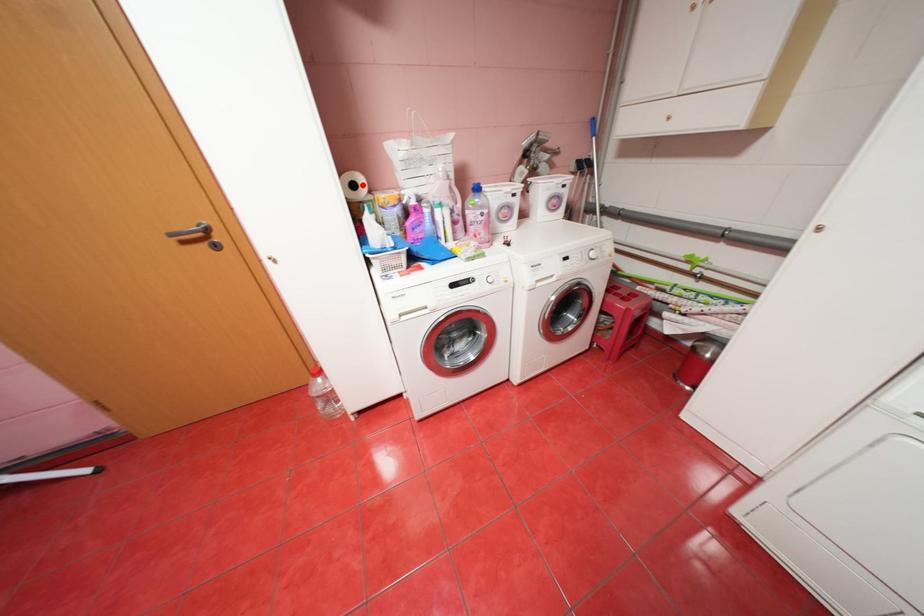
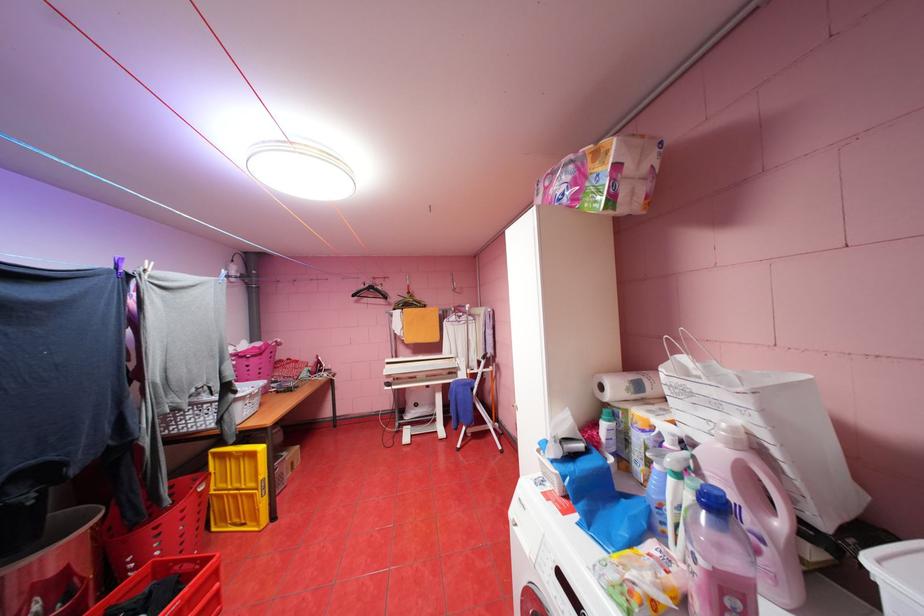
Question: I am providing you with two images of the same scene from different viewpoints. Given a red point in image1, look at the same physical point in image2. Is it:

Choices:
 (A) Closer to the viewpoint
 (B) Farther from the viewpoint

Answer: (B)